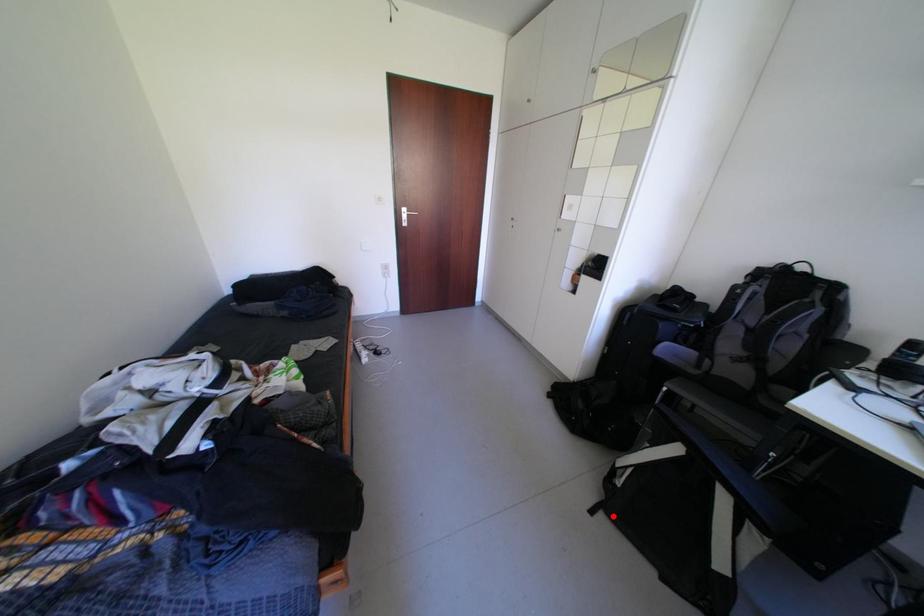
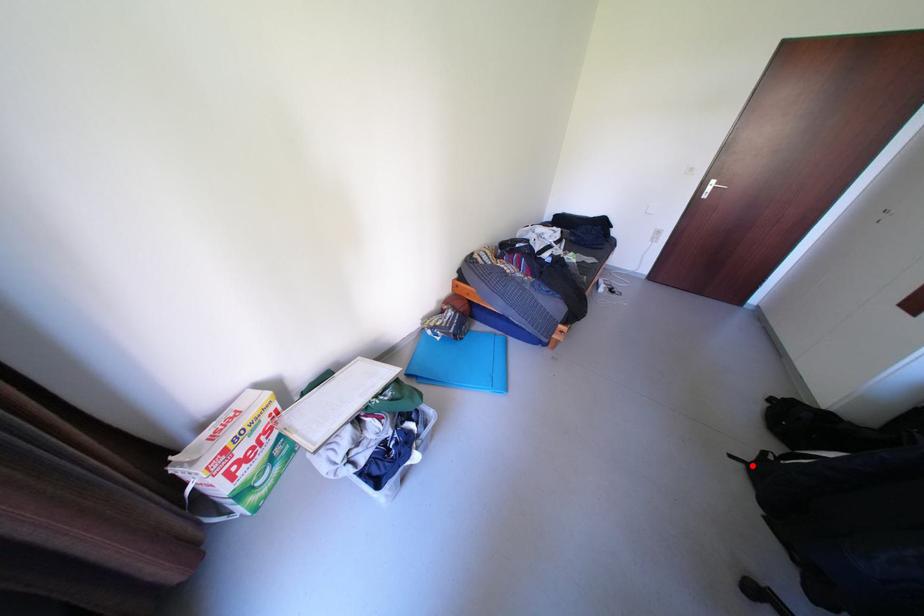
I am providing you with two images of the same scene from different viewpoints. A red point is marked on the first image and another point is marked on the second image. Does the point marked in image1 correspond to the same location as the one in image2?

Yes